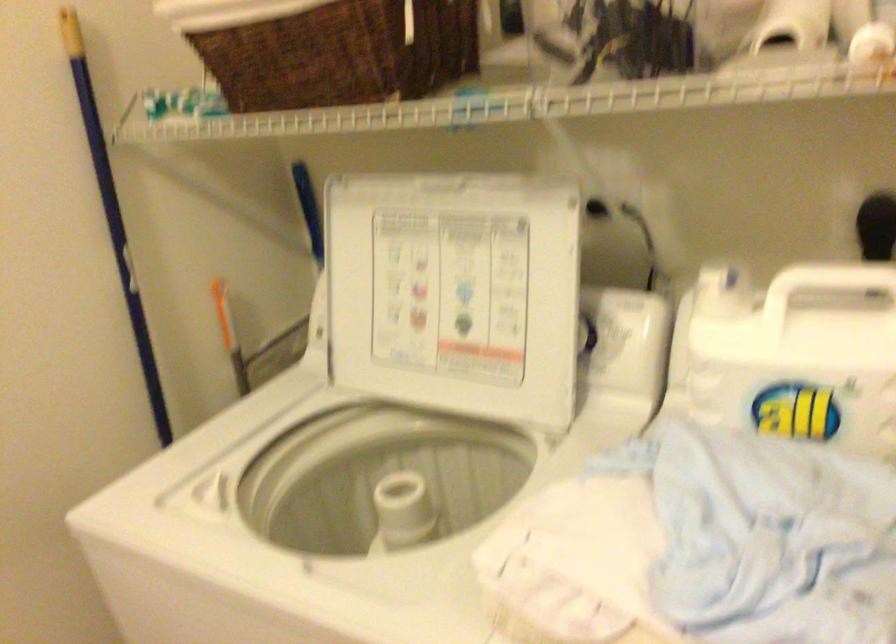
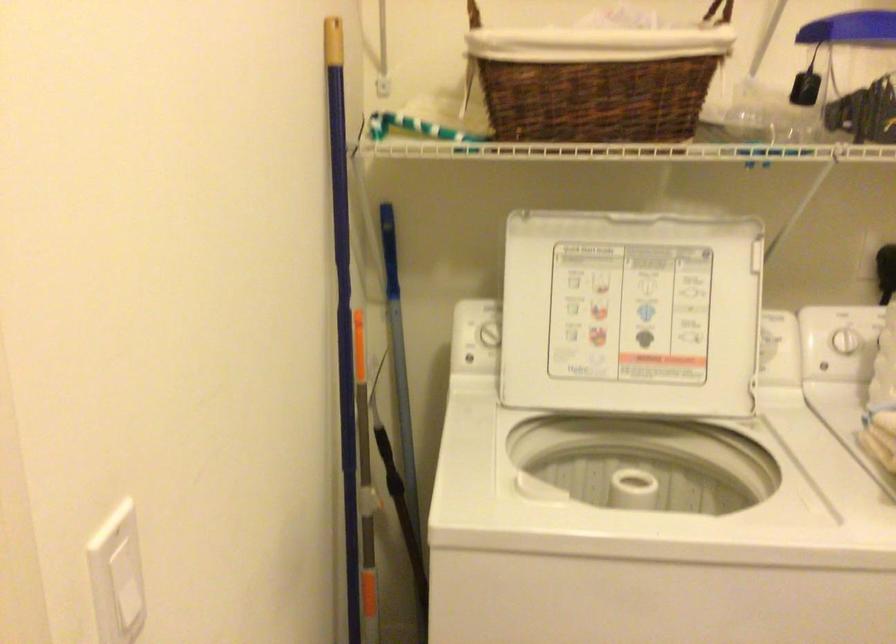
The point at (444, 295) is marked in the first image. Where is the corresponding point in the second image?

(631, 313)